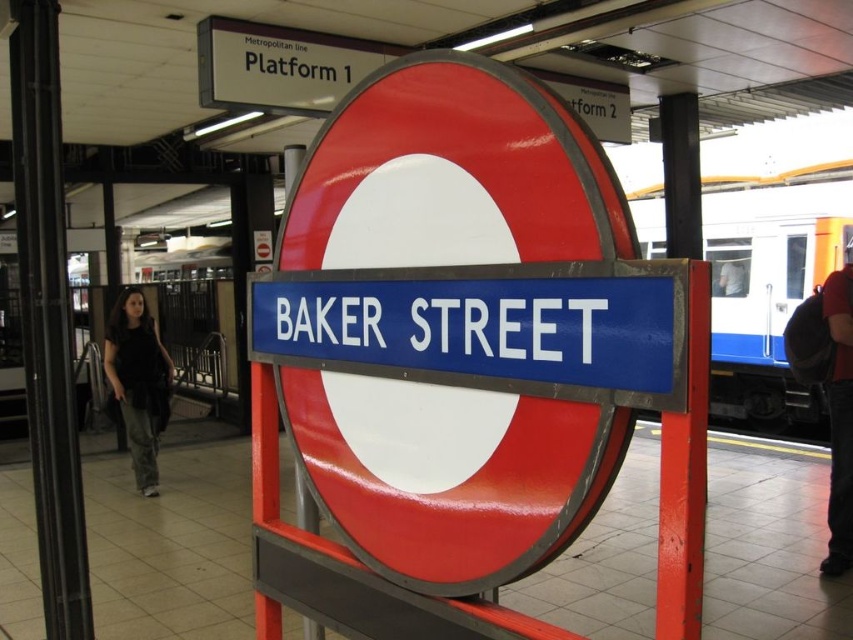
You are a commuter at Baker Street Underground Station. You notice two people in the scene, one wearing dark gray pants at left and another with dark hair at center. Which of these two is standing closer to the ground?

The dark gray pants at left is located below dark hair at center, so the person wearing dark gray pants at left is standing closer to the ground.